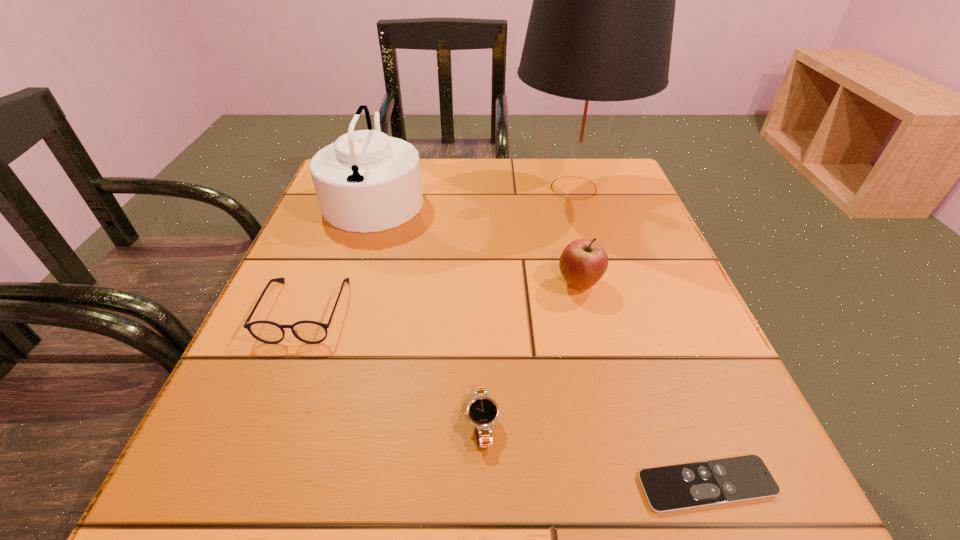
Locate an element on the screen. This screenshot has height=540, width=960. vacant point located 0.220m on the front of the apple is located at coordinates (610, 407).

I want to click on vacant space located 0.140m on the front-facing side of the spectacles, so click(261, 421).

At what (x,y) coordinates should I click in order to perform the action: click on vacant region located 0.120m on the left of the fifth farthest object. Please return your answer as a coordinate pair (x, y). This screenshot has width=960, height=540. Looking at the image, I should click on (380, 423).

The image size is (960, 540). Find the location of `vacant space located 0.130m on the back of the shortest object`. vacant space located 0.130m on the back of the shortest object is located at coordinates (666, 376).

In order to click on lampshade present at the far edge in this screenshot , I will do `click(600, 30)`.

Image resolution: width=960 pixels, height=540 pixels. I want to click on kettle located in the far edge section of the desktop, so click(x=366, y=181).

At what (x,y) coordinates should I click in order to perform the action: click on watch that is at the near edge. Please return your answer as a coordinate pair (x, y). This screenshot has height=540, width=960. Looking at the image, I should click on (482, 411).

Locate an element on the screen. remote control that is at the near edge is located at coordinates (683, 486).

Where is `kettle located at the left edge`? Image resolution: width=960 pixels, height=540 pixels. kettle located at the left edge is located at coordinates (366, 181).

Find the location of a particular element. The height and width of the screenshot is (540, 960). spectacles that is at the left edge is located at coordinates (311, 332).